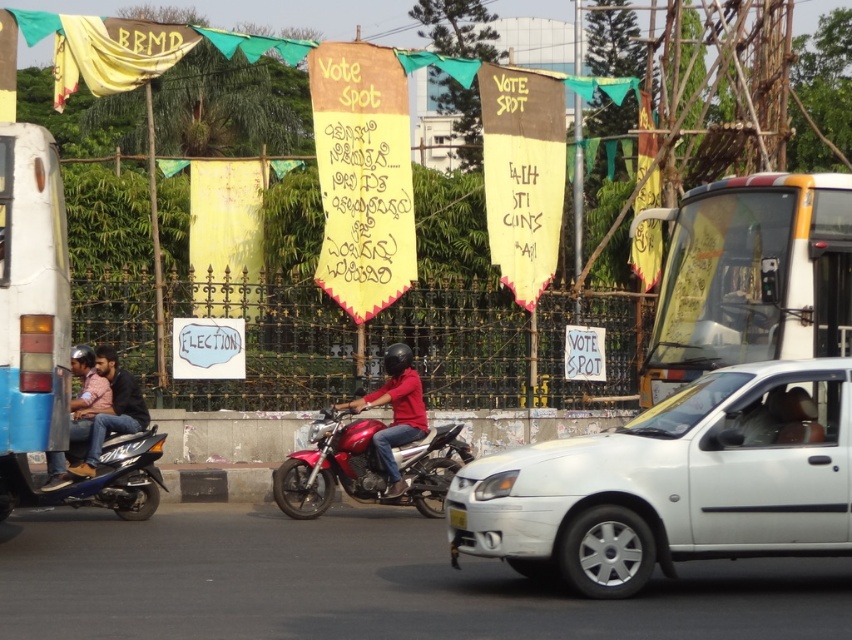
Which is more to the right, shiny metallic motorcycle at center or matte black motorcycle at left?

From the viewer's perspective, shiny metallic motorcycle at center appears more on the right side.

In the scene shown: Is shiny metallic motorcycle at center to the left of matte black motorcycle at left from the viewer's perspective?

No, shiny metallic motorcycle at center is not to the left of matte black motorcycle at left.

Locate an element on the screen. The height and width of the screenshot is (640, 852). shiny metallic motorcycle at center is located at coordinates (366, 467).

Can you confirm if white matte car at center is thinner than matte blue jeans at left?

No, white matte car at center is not thinner than matte blue jeans at left.

Is white matte car at center shorter than matte blue jeans at left?

Incorrect, white matte car at center's height does not fall short of matte blue jeans at left's.

Describe the element at coordinates (674, 483) in the screenshot. I see `white matte car at center` at that location.

At what (x,y) coordinates should I click in order to perform the action: click on white matte car at center. Please return your answer as a coordinate pair (x, y). Looking at the image, I should click on (674, 483).

Which is in front, point (793, 493) or point (458, 522)?

Positioned in front is point (793, 493).

Can you confirm if white matte car at center is smaller than yellow matte license plate at lower center?

Incorrect, white matte car at center is not smaller in size than yellow matte license plate at lower center.

Which is behind, point (484, 538) or point (453, 516)?

The point (453, 516) is more distant.

Find the location of a particular element. This screenshot has height=640, width=852. white matte car at center is located at coordinates (674, 483).